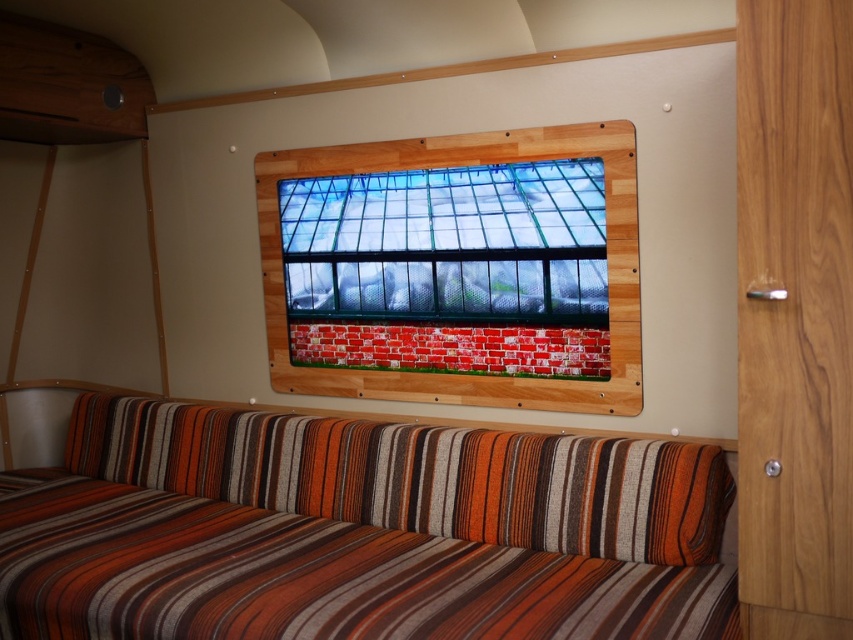
You are sitting on the striped fabric couch at lower center in the camper. You notice a point marked at coordinates (358, 531). Where exactly is this point located?

The point at coordinates (358, 531) is located on the striped fabric couch at lower center.

You are inside the camper and want to place a small plant pot on the wooden frame at center. Where exactly should you place it?

You should place the small plant pot at the wooden frame at center located at the coordinates (456, 268).